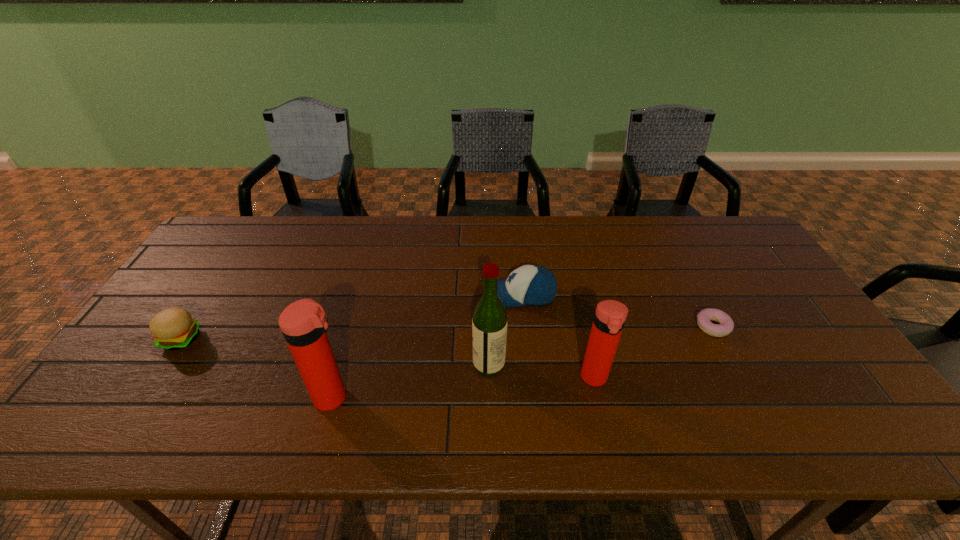
The width and height of the screenshot is (960, 540). In order to click on vacant position in the image that satisfies the following two spatial constraints: 1. on the front-facing side of the doughnut; 2. on the left side of the farthest object in this screenshot , I will do `click(525, 327)`.

Find the location of a particular element. vacant space that satisfies the following two spatial constraints: 1. on the front-facing side of the farthest object; 2. on the front side of the fifth tallest object is located at coordinates (526, 339).

Image resolution: width=960 pixels, height=540 pixels. In order to click on free location that satisfies the following two spatial constraints: 1. on the front-facing side of the shortest object; 2. on the left side of the baseball cap in this screenshot , I will do `click(525, 327)`.

The height and width of the screenshot is (540, 960). Find the location of `vacant space that satisfies the following two spatial constraints: 1. on the label of the third tallest object; 2. on the left side of the liquor`. vacant space that satisfies the following two spatial constraints: 1. on the label of the third tallest object; 2. on the left side of the liquor is located at coordinates (490, 378).

The image size is (960, 540). Identify the location of free location that satisfies the following two spatial constraints: 1. on the front-facing side of the third shortest object; 2. on the right side of the doughnut. (525, 327).